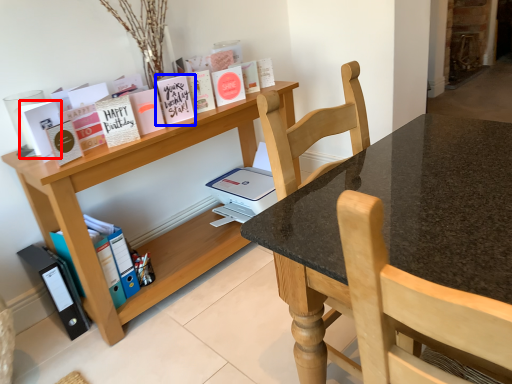
Question: Which of the following is the closest to the observer, paperback book (highlighted by a red box) or paperback book (highlighted by a blue box)?

Choices:
 (A) paperback book
 (B) paperback book

Answer: (A)